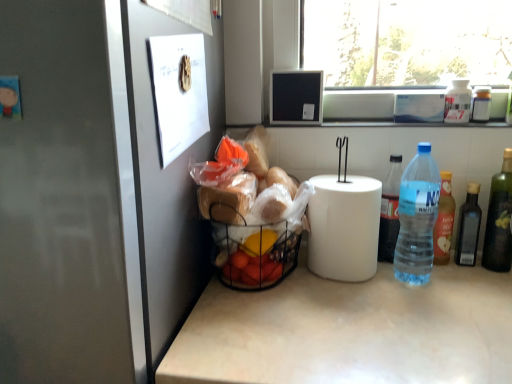
This screenshot has height=384, width=512. I want to click on black matte frame at upper center, so click(296, 97).

What do you see at coordinates (444, 221) in the screenshot? I see `translucent plastic bottle at right, which ranks as the 3th bottle in left-to-right order` at bounding box center [444, 221].

Where is `green glass bottle at right, the 1th bottle when ordered from right to left`? green glass bottle at right, the 1th bottle when ordered from right to left is located at coordinates (499, 219).

Identify the location of black matte frame at upper center. The height and width of the screenshot is (384, 512). (296, 97).

There is a blue plastic bottle at right, which appears as the seventh bottle when viewed from the right. At what (x,y) coordinates should I click in order to perform the action: click on the 2nd bottle above it (from the image's perspective). Please return your answer as a coordinate pair (x, y). The image size is (512, 384). Looking at the image, I should click on (457, 102).

Can you confirm if white plastic bottle at upper right, positioned as the fourth bottle in left-to-right order, is smaller than blue plastic bottle at right, the 1th bottle when ordered from left to right?

Yes.

Is white plastic bottle at upper right, acting as the fourth bottle starting from the right, not inside blue plastic bottle at right, which appears as the seventh bottle when viewed from the right?

That's correct, white plastic bottle at upper right, acting as the fourth bottle starting from the right, is outside of blue plastic bottle at right, which appears as the seventh bottle when viewed from the right.

Based on the photo, from their relative heights in the image, would you say white plastic bottle at upper right, positioned as the fourth bottle in left-to-right order, is taller or shorter than white plastic bottle at upper right, the sixth bottle in the left-to-right sequence?

Clearly, white plastic bottle at upper right, positioned as the fourth bottle in left-to-right order, is taller compared to white plastic bottle at upper right, the sixth bottle in the left-to-right sequence.

Does white plastic bottle at upper right, acting as the fourth bottle starting from the right, have a smaller size compared to white plastic bottle at upper right, which is counted as the 2th bottle, starting from the right?

No, white plastic bottle at upper right, acting as the fourth bottle starting from the right, is not smaller than white plastic bottle at upper right, which is counted as the 2th bottle, starting from the right.

In the scene shown: Is white plastic bottle at upper right, positioned as the fourth bottle in left-to-right order, positioned beyond the bounds of white plastic bottle at upper right, which is counted as the 2th bottle, starting from the right?

That's correct, white plastic bottle at upper right, positioned as the fourth bottle in left-to-right order, is outside of white plastic bottle at upper right, which is counted as the 2th bottle, starting from the right.

From a real-world perspective, is white plastic bottle at upper right, acting as the fourth bottle starting from the right, under white plastic bottle at upper right, which is counted as the 2th bottle, starting from the right?

No, from a real-world perspective, white plastic bottle at upper right, acting as the fourth bottle starting from the right, is not under white plastic bottle at upper right, which is counted as the 2th bottle, starting from the right.

Which object is closer to the camera, white matte paper towel at center or dark glass bottle at right, placed as the 5th bottle when sorted from left to right?

white matte paper towel at center.

From the image's perspective, is white matte paper towel at center above dark glass bottle at right, placed as the 5th bottle when sorted from left to right?

Correct, white matte paper towel at center appears higher than dark glass bottle at right, placed as the 5th bottle when sorted from left to right, in the image.

From a real-world perspective, which is physically above, white matte paper towel at center or dark glass bottle at right, positioned as the 3th bottle in right-to-left order?

From a 3D spatial view, white matte paper towel at center is above.

How different are the orientations of dark glass bottle at right, positioned as the 3th bottle in right-to-left order, and black wire basket at lower left in degrees?

0.00193 degrees.

Between dark glass bottle at right, placed as the 5th bottle when sorted from left to right, and black wire basket at lower left, which one has larger size?

Bigger between the two is black wire basket at lower left.

Find the location of `basket container lying on the left of dark glass bottle at right, positioned as the 3th bottle in right-to-left order`. basket container lying on the left of dark glass bottle at right, positioned as the 3th bottle in right-to-left order is located at coordinates (252, 251).

Is dark glass bottle at right, placed as the 5th bottle when sorted from left to right, looking in the opposite direction of black wire basket at lower left?

No.

Who is taller, blue plastic bottle at right, which appears as the seventh bottle when viewed from the right, or white plastic bottle at upper right, positioned as the fourth bottle in left-to-right order?

Standing taller between the two is blue plastic bottle at right, which appears as the seventh bottle when viewed from the right.

Is blue plastic bottle at right, which appears as the seventh bottle when viewed from the right, to the left of white plastic bottle at upper right, positioned as the fourth bottle in left-to-right order, from the viewer's perspective?

Correct, you'll find blue plastic bottle at right, which appears as the seventh bottle when viewed from the right, to the left of white plastic bottle at upper right, positioned as the fourth bottle in left-to-right order.

Would you say blue plastic bottle at right, the 1th bottle when ordered from left to right, is inside or outside white plastic bottle at upper right, acting as the fourth bottle starting from the right?

blue plastic bottle at right, the 1th bottle when ordered from left to right, is outside white plastic bottle at upper right, acting as the fourth bottle starting from the right.

From the image's perspective, does black wire basket at lower left appear higher than dark glass bottle at right, placed as the 5th bottle when sorted from left to right?

Actually, black wire basket at lower left appears below dark glass bottle at right, placed as the 5th bottle when sorted from left to right, in the image.

Is black wire basket at lower left facing away from dark glass bottle at right, positioned as the 3th bottle in right-to-left order?

black wire basket at lower left is not turned away from dark glass bottle at right, positioned as the 3th bottle in right-to-left order.

Between point (251, 242) and point (471, 196), which one is positioned behind?

Positioned behind is point (471, 196).

From a real-world perspective, which object rests below the other?

From a 3D spatial view, black wire basket at lower left is below.

Is dark glass bottle at right, placed as the 5th bottle when sorted from left to right, taller or shorter than black matte frame at upper center?

Clearly, dark glass bottle at right, placed as the 5th bottle when sorted from left to right, is taller compared to black matte frame at upper center.

Is dark glass bottle at right, positioned as the 3th bottle in right-to-left order, not near black matte frame at upper center?

They are positioned close to each other.

Which of these two, dark glass bottle at right, placed as the 5th bottle when sorted from left to right, or black matte frame at upper center, is wider?

Wider between the two is black matte frame at upper center.

From the image's perspective, is dark glass bottle at right, placed as the 5th bottle when sorted from left to right, located beneath black matte frame at upper center?

Yes, from the image's perspective, dark glass bottle at right, placed as the 5th bottle when sorted from left to right, is below black matte frame at upper center.

Image resolution: width=512 pixels, height=384 pixels. Identify the location of bottle that is the 3rd one when counting leftward from the white plastic bottle at upper right, positioned as the fourth bottle in left-to-right order. (390, 211).

Find the location of a particular element. Image resolution: width=512 pixels, height=384 pixels. the 2nd bottle to the right when counting from the white plastic bottle at upper right, positioned as the fourth bottle in left-to-right order is located at coordinates (481, 105).

Looking at the image, which one is located further to blue plastic bottle at right, the 1th bottle when ordered from left to right, white plastic bottle at upper right, which is counted as the 2th bottle, starting from the right, or black matte frame at upper center?

Based on the image, white plastic bottle at upper right, which is counted as the 2th bottle, starting from the right, appears to be further to blue plastic bottle at right, the 1th bottle when ordered from left to right.

Estimate the real-world distances between objects in this image. Which object is closer to blue plastic bottle at right, the 1th bottle when ordered from left to right, satin silver fridge at left or white plastic bottle at upper right, the sixth bottle in the left-to-right sequence?

white plastic bottle at upper right, the sixth bottle in the left-to-right sequence, is closer to blue plastic bottle at right, the 1th bottle when ordered from left to right.

Based on the photo, based on their spatial positions, is white plastic bottle at upper right, positioned as the fourth bottle in left-to-right order, or black matte frame at upper center further from white matte paper towel at center?

→ The object further to white matte paper towel at center is white plastic bottle at upper right, positioned as the fourth bottle in left-to-right order.

Considering their positions, is black wire basket at lower left positioned closer to green glass bottle at right, which ranks as the seventh bottle in left-to-right order, than satin silver fridge at left?

black wire basket at lower left.

Which object lies nearer to the anchor point green glass bottle at right, which ranks as the seventh bottle in left-to-right order, blue plastic bottle at right, which appears as the seventh bottle when viewed from the right, or clear plastic bottle at right, positioned as the 2th bottle in left-to-right order?

Among the two, clear plastic bottle at right, positioned as the 2th bottle in left-to-right order, is located nearer to green glass bottle at right, which ranks as the seventh bottle in left-to-right order.

From the picture: Based on their spatial positions, is clear plastic bottle at right, marked as the sixth bottle in a right-to-left arrangement, or white plastic bottle at upper right, the sixth bottle in the left-to-right sequence, closer to black matte frame at upper center?

clear plastic bottle at right, marked as the sixth bottle in a right-to-left arrangement, is positioned closer to the anchor black matte frame at upper center.

Which object lies further to the anchor point satin silver fridge at left, white plastic bottle at upper right, which is counted as the 2th bottle, starting from the right, or black matte frame at upper center?

The object further to satin silver fridge at left is white plastic bottle at upper right, which is counted as the 2th bottle, starting from the right.

From the image, which object appears to be nearer to dark glass bottle at right, placed as the 5th bottle when sorted from left to right, white plastic bottle at upper right, which is counted as the 2th bottle, starting from the right, or translucent plastic bottle at right, marked as the 5th bottle in a right-to-left arrangement?

The object closer to dark glass bottle at right, placed as the 5th bottle when sorted from left to right, is translucent plastic bottle at right, marked as the 5th bottle in a right-to-left arrangement.

Locate an element on the screen. paper towel between satin silver fridge at left and blue plastic bottle at right, the 1th bottle when ordered from left to right, in the horizontal direction is located at coordinates (344, 227).

You are a GUI agent. You are given a task and a screenshot of the screen. Output one action in this format:
    pyautogui.click(x=<x>, y=<y>)
    Task: Click on the appliance between black wire basket at lower left and white plastic bottle at upper right, which is counted as the 2th bottle, starting from the right, from left to right
    Image resolution: width=512 pixels, height=384 pixels.
    Given the screenshot: What is the action you would take?
    pyautogui.click(x=296, y=97)

Locate an element on the screen. This screenshot has width=512, height=384. bottle located between satin silver fridge at left and clear plastic bottle at right, positioned as the 2th bottle in left-to-right order, in the left-right direction is located at coordinates (390, 211).

This screenshot has width=512, height=384. I want to click on paper towel located between black wire basket at lower left and green glass bottle at right, which ranks as the seventh bottle in left-to-right order, in the left-right direction, so click(x=344, y=227).